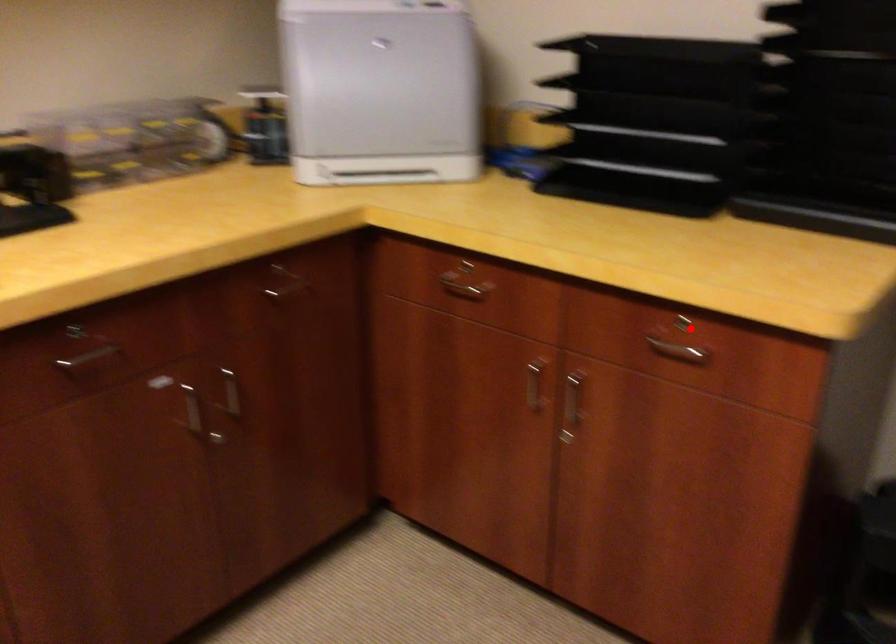
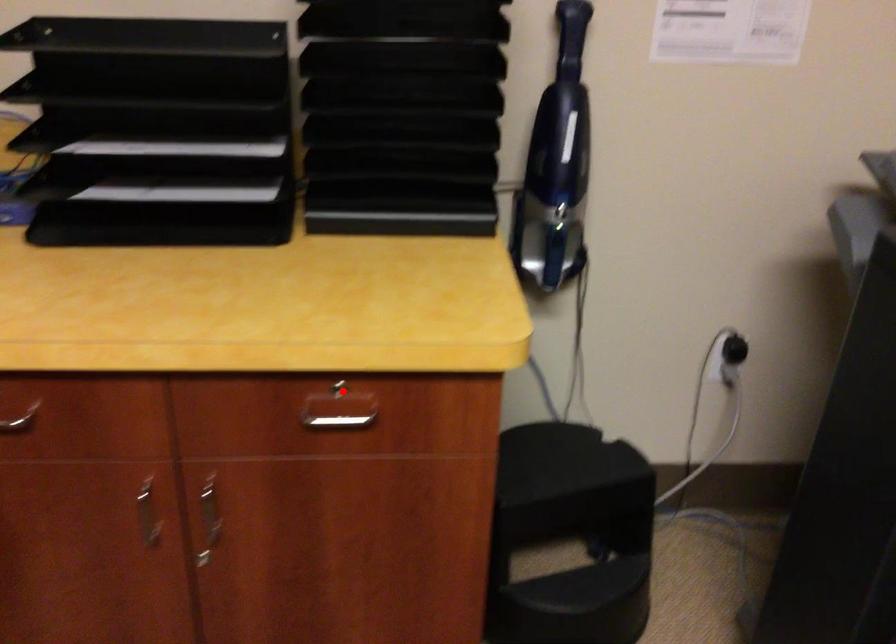
I am providing you with two images of the same scene from different viewpoints. A red point is marked on the first image and another point is marked on the second image. Is the marked point in image1 the same physical position as the marked point in image2?

Yes